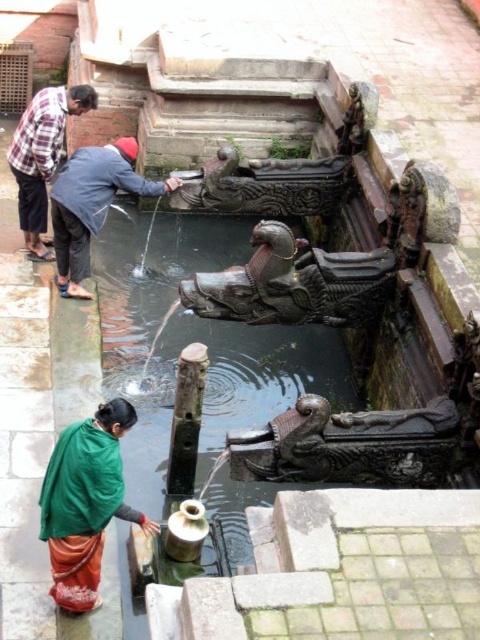
Between green fabric at lower left and plaid shirt at upper left, which one appears on the left side from the viewer's perspective?

Positioned to the left is plaid shirt at upper left.

Does green fabric at lower left lie behind plaid shirt at upper left?

No, green fabric at lower left is closer to the viewer.

This screenshot has height=640, width=480. What are the coordinates of `green fabric at lower left` in the screenshot? It's located at (84, 502).

Image resolution: width=480 pixels, height=640 pixels. Identify the location of dark brown stone dragon at center. (349, 445).

The image size is (480, 640). Describe the element at coordinates (349, 445) in the screenshot. I see `dark brown stone dragon at center` at that location.

The height and width of the screenshot is (640, 480). Identify the location of dark brown stone dragon at center. (349, 445).

Does black polished stone dragon at center appear on the right side of green fabric at lower left?

Indeed, black polished stone dragon at center is positioned on the right side of green fabric at lower left.

Locate an element on the screen. black polished stone dragon at center is located at coordinates (294, 284).

Between point (197, 301) and point (85, 525), which one is positioned in front?

Point (85, 525)

What are the coordinates of `black polished stone dragon at center` in the screenshot? It's located at 294,284.